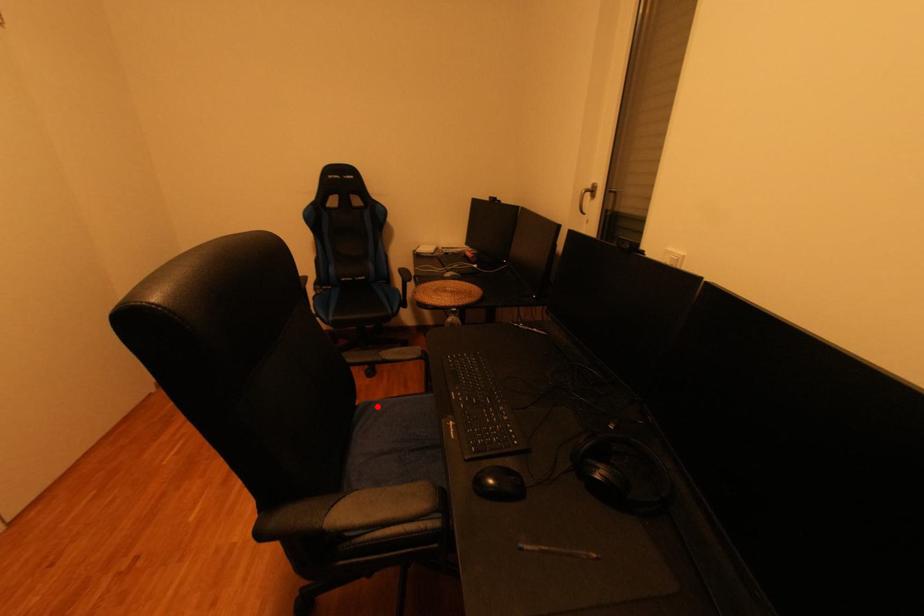
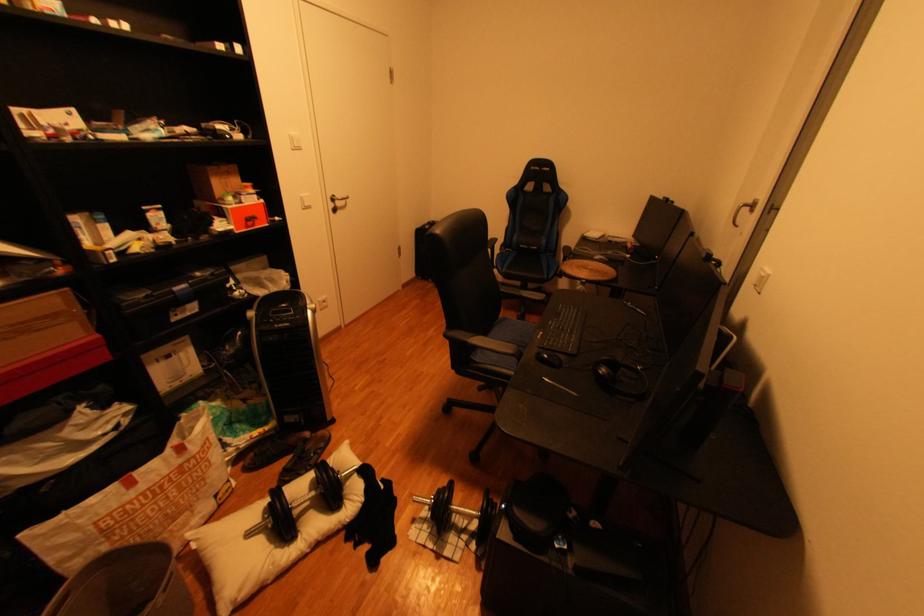
Question: A red point is marked in image1. In image2, is the corresponding 3D point closer to the camera or farther? Reply with the corresponding letter.

Choices:
 (A) The corresponding 3D point is closer.
 (B) The corresponding 3D point is farther.

Answer: (B)